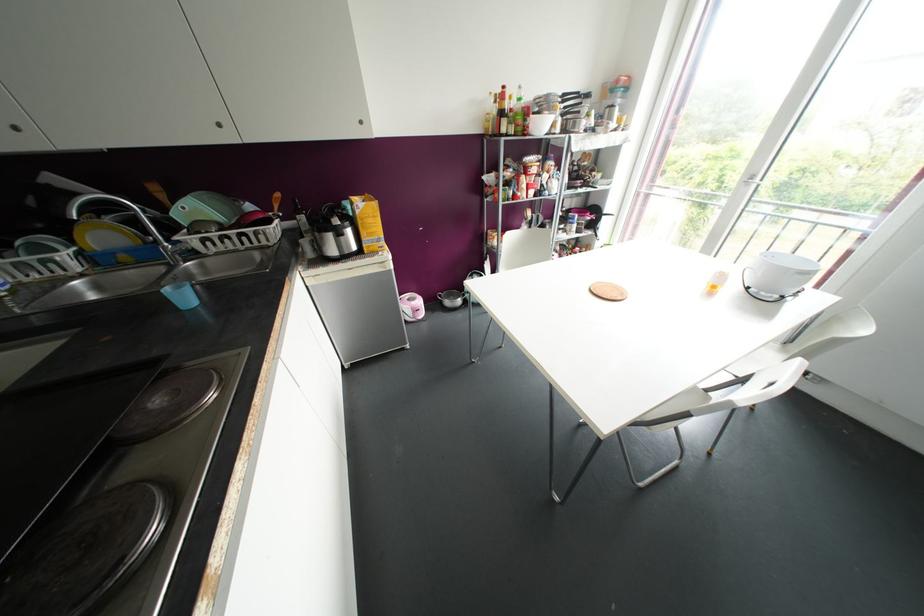
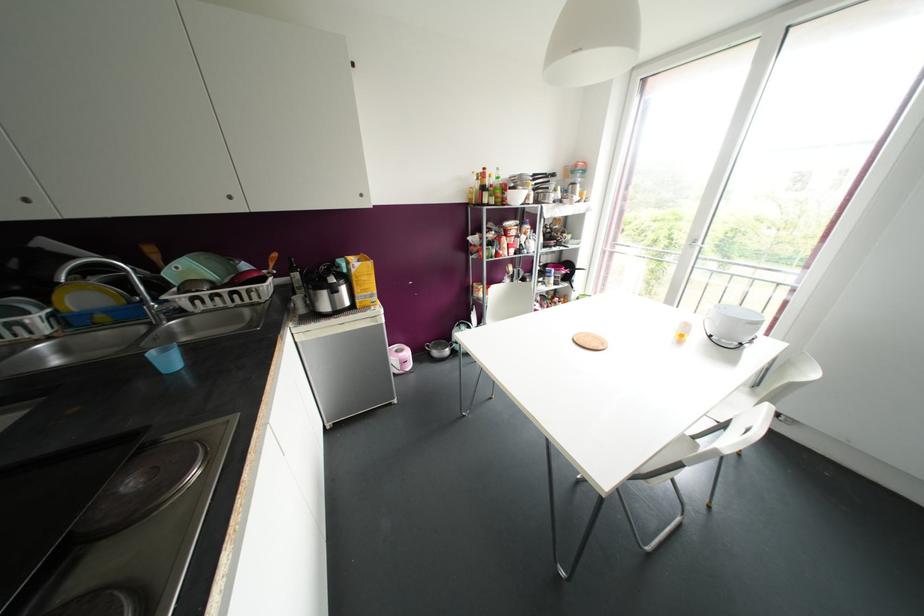
The point at (616, 108) is marked in the first image. Where is the corresponding point in the second image?

(578, 185)